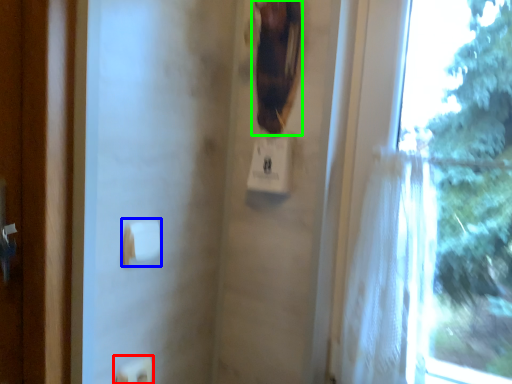
Question: Estimate the real-world distances between objects in this image. Which object is farther from light switch (highlighted by a red box), towel bar (highlighted by a blue box) or animal (highlighted by a green box)?

Choices:
 (A) towel bar
 (B) animal

Answer: (B)